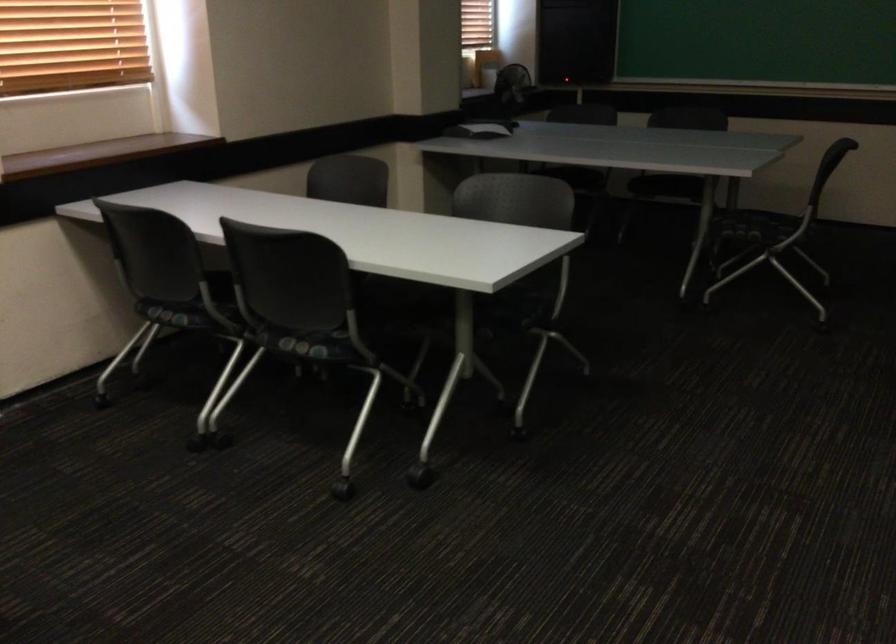
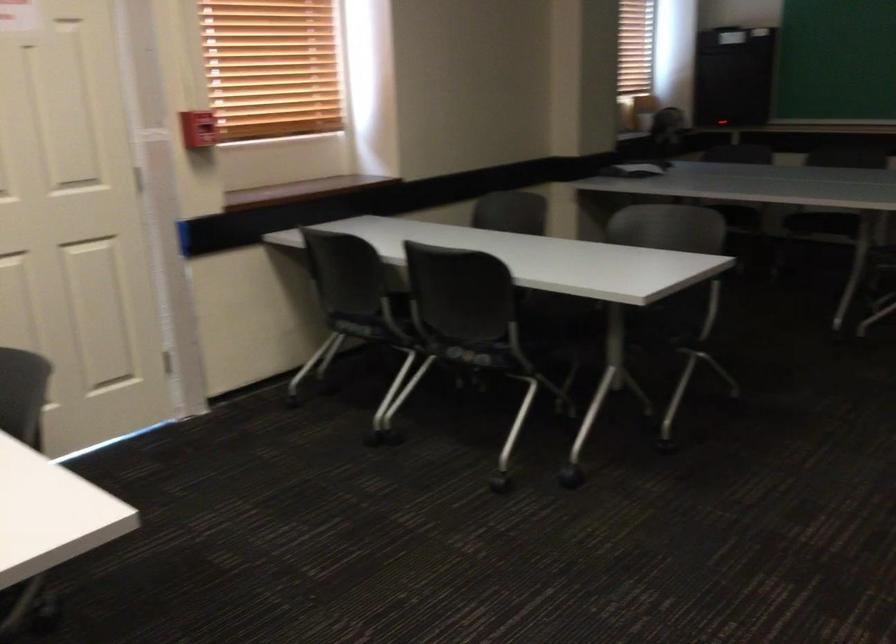
Find the pixel in the second image that matches the point at 179,315 in the first image.

(360, 328)